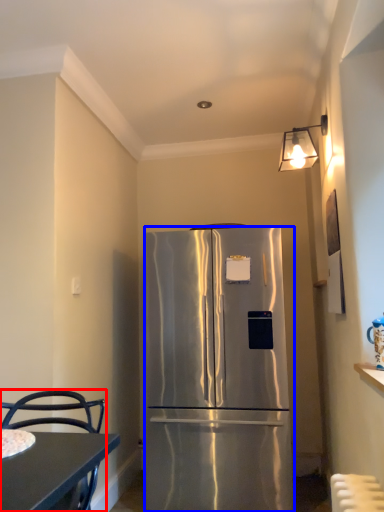
Question: Which object is further to the camera taking this photo, chair (highlighted by a red box) or refrigerator (highlighted by a blue box)?

Choices:
 (A) chair
 (B) refrigerator

Answer: (B)